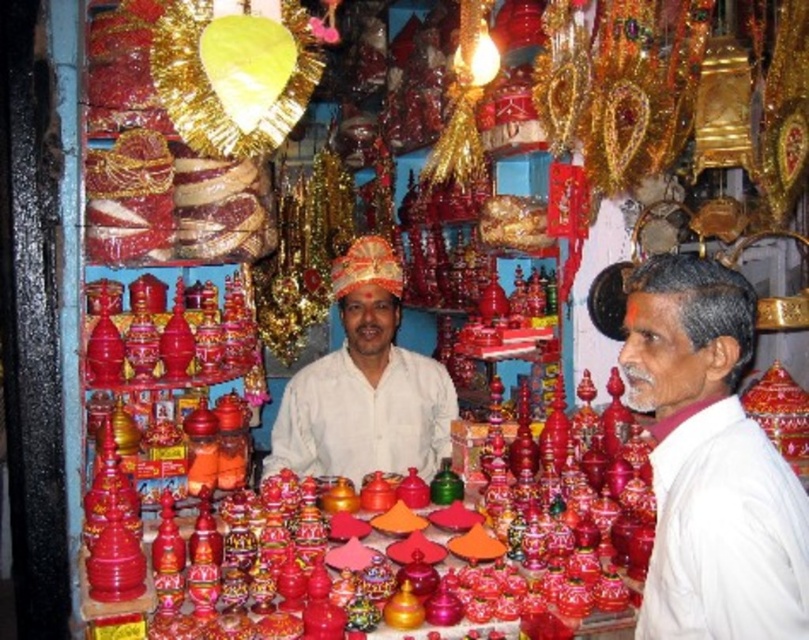
Question: Is white matte shirt at right positioned at the back of matte white cloth at center?

Choices:
 (A) yes
 (B) no

Answer: (B)

Question: Does white matte shirt at right have a smaller size compared to matte white cloth at center?

Choices:
 (A) yes
 (B) no

Answer: (A)

Question: Which object is closer to the camera taking this photo?

Choices:
 (A) white matte shirt at right
 (B) matte white cloth at center

Answer: (A)

Question: In this image, where is white matte shirt at right located relative to matte white cloth at center?

Choices:
 (A) right
 (B) left

Answer: (A)

Question: Which of the following is the farthest from the observer?

Choices:
 (A) (718, 540)
 (B) (426, 406)

Answer: (B)